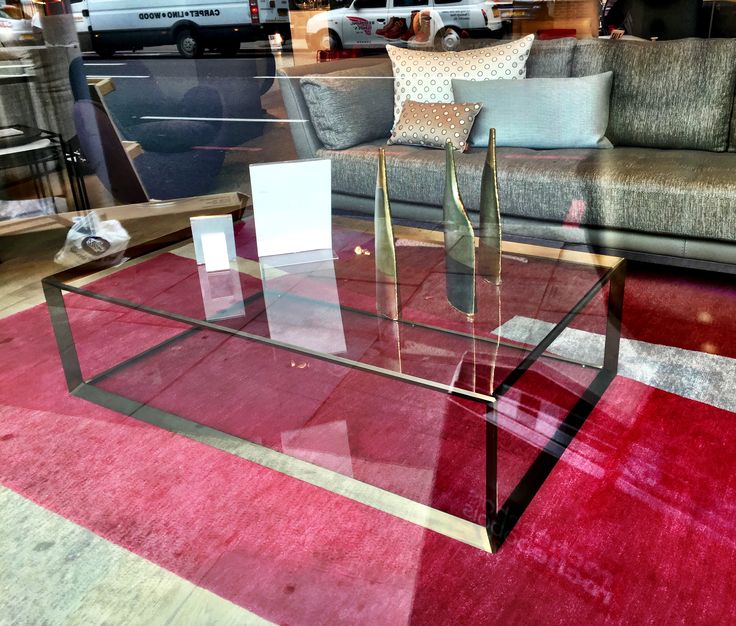
Where is `cushions`? The image size is (736, 626). cushions is located at coordinates (444, 69), (508, 91), (424, 121).